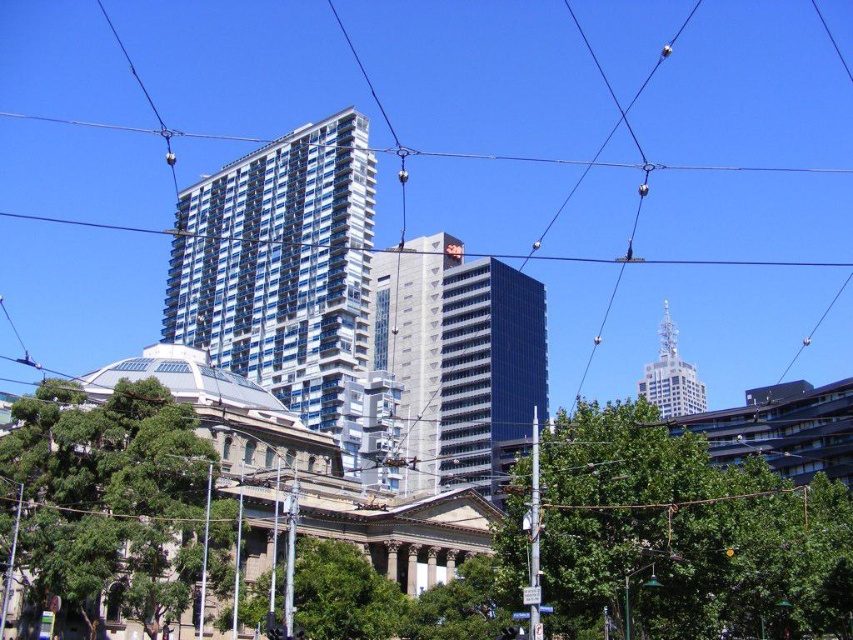
You are an architect analyzing the urban scene. You notice the glassy blue building at center and the green leafy tree at center. Which one has a greater width in the image?

The glassy blue building at center has a greater width than the green leafy tree at center according to the description.

You are a photographer standing at the center of the scene. You want to take a photo that includes both point (x=427, y=420) and point (x=376, y=596). Which point will appear closer to the bottom edge of your camera frame?

Point (x=376, y=596) will appear closer to the bottom edge of the camera frame because it is closer to the camera than point (x=427, y=420).